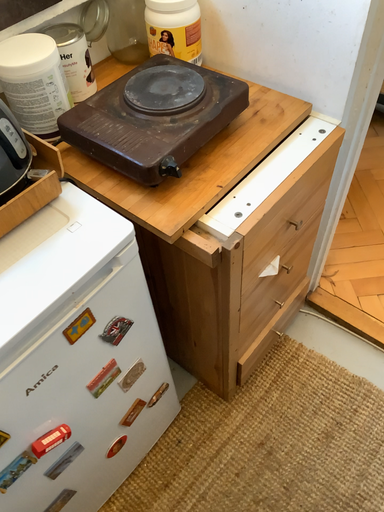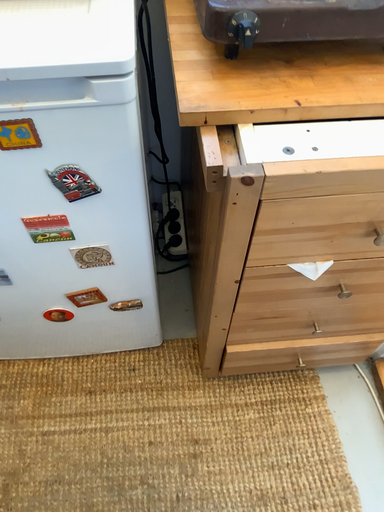
Question: How did the camera likely rotate when shooting the video?

Choices:
 (A) rotated right
 (B) rotated left

Answer: (B)